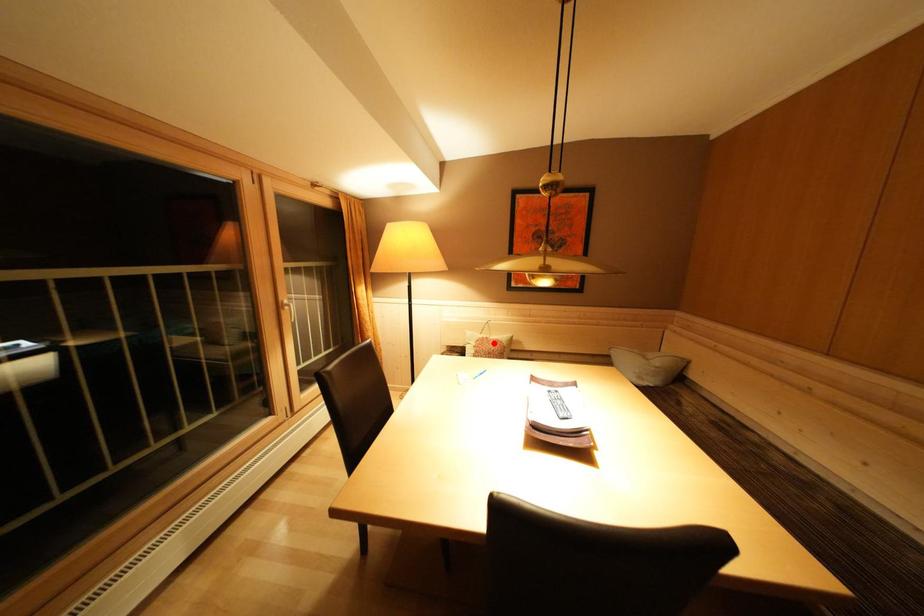
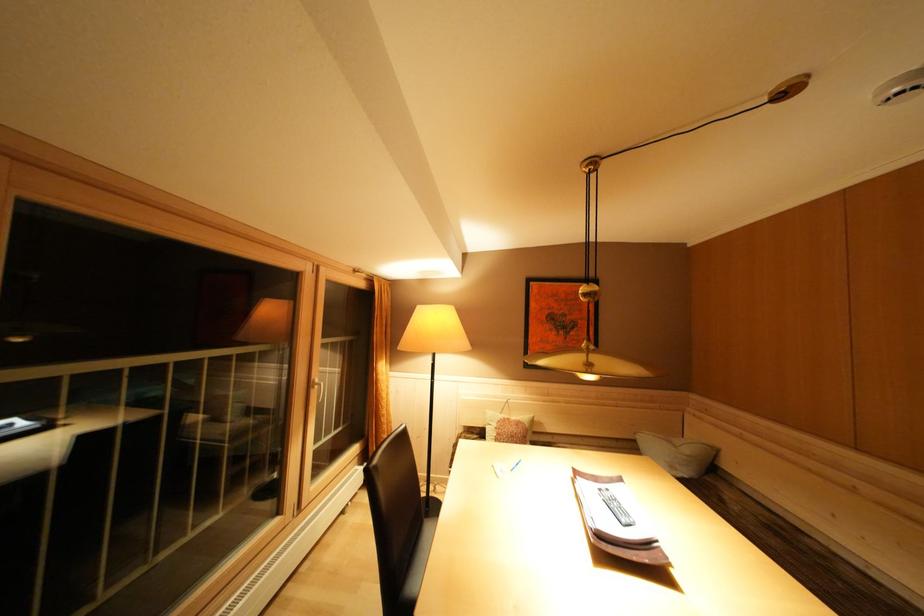
Question: I am providing you with two images of the same scene from different viewpoints. Image1 has a red point marked. In image2, the corresponding 3D location appears at what relative position? Reply with the corresponding letter.

Choices:
 (A) Closer
 (B) Farther

Answer: (B)